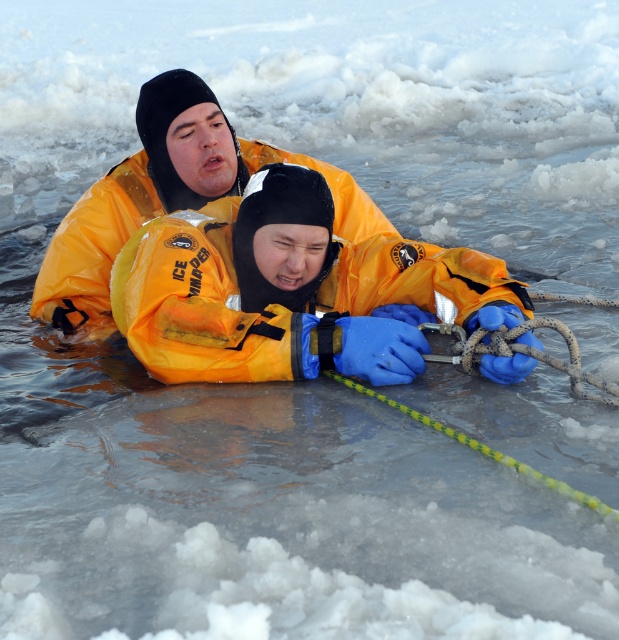
Consider the image. Can you confirm if orange waterproof jacket at center is positioned below yellow matte life jacket at upper center?

Yes, orange waterproof jacket at center is below yellow matte life jacket at upper center.

Is point (405, 275) in front of point (378, 218)?

Yes, it is.

At what (x,y) coordinates should I click in order to perform the action: click on orange waterproof jacket at center. Please return your answer as a coordinate pair (x, y). The height and width of the screenshot is (640, 619). Looking at the image, I should click on (197, 305).